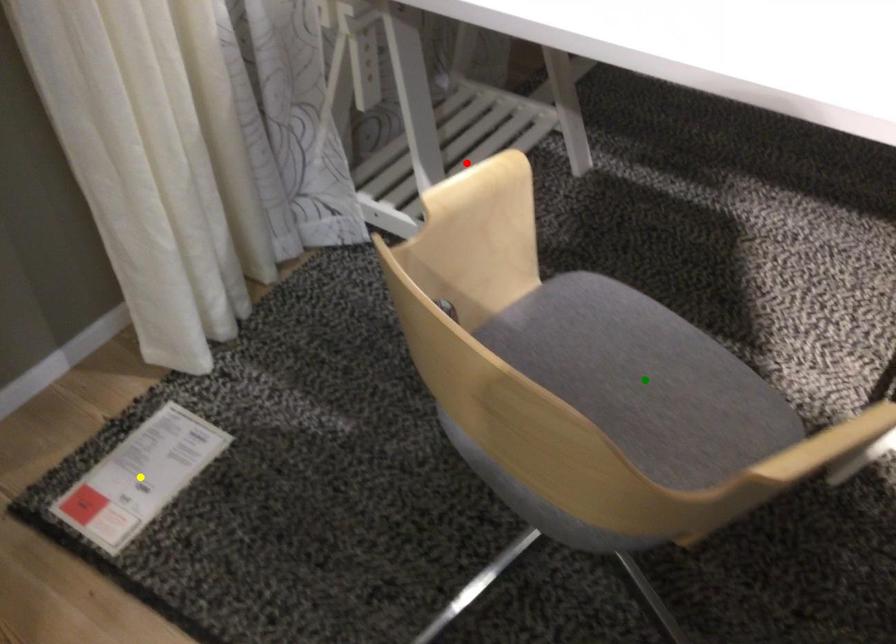
Order these from nearest to farthest:
1. green point
2. yellow point
3. red point

green point < yellow point < red point